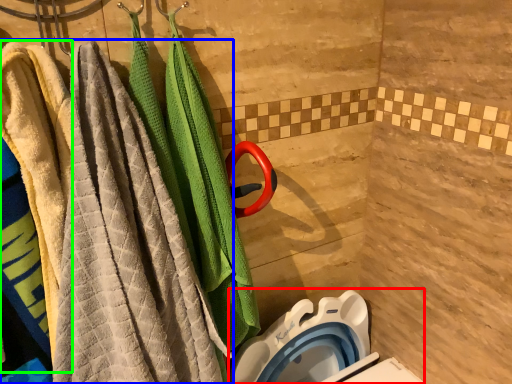
Question: Estimate the real-world distances between objects in this image. Which object is closer to toilet bowl (highlighted by a red box), towel (highlighted by a blue box) or beach towel (highlighted by a green box)?

Choices:
 (A) towel
 (B) beach towel

Answer: (A)